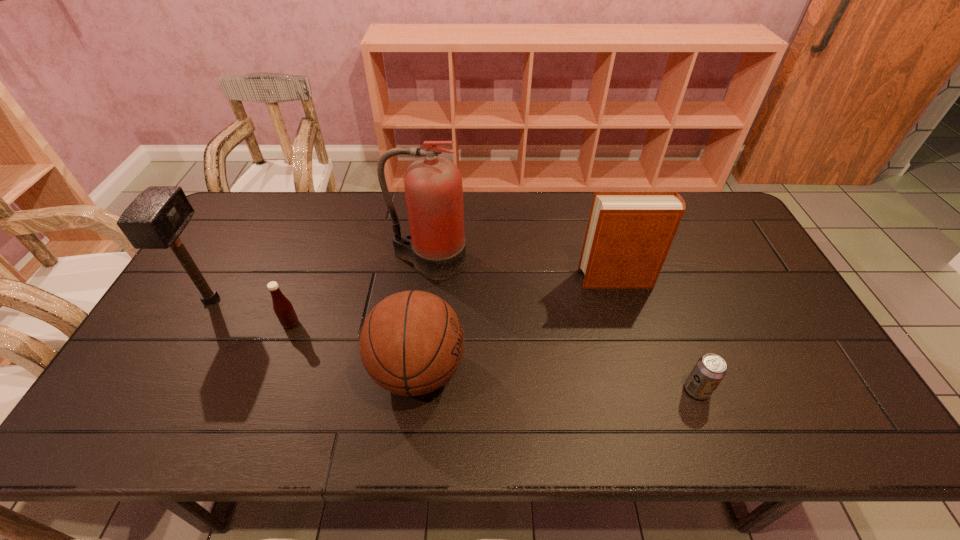
Find the location of a particular element. This screenshot has width=960, height=540. vacant space situated 0.250m on the open cover of the third tallest object is located at coordinates (496, 279).

You are a GUI agent. You are given a task and a screenshot of the screen. Output one action in this format:
    pyautogui.click(x=<x>, y=<y>)
    Task: Click on the vacant area situated on the open cover of the third tallest object
    This screenshot has width=960, height=540.
    Given the screenshot: What is the action you would take?
    pyautogui.click(x=556, y=279)

Where is `free space located on the open cover of the third tallest object`? free space located on the open cover of the third tallest object is located at coordinates pos(546,279).

Locate an element on the screen. This screenshot has height=540, width=960. free spot located on the side with brand label of the basketball is located at coordinates (493, 370).

What are the coordinates of `vacant area situated on the right of the fifth object from right to left` in the screenshot? It's located at (391, 324).

Where is `vacant space located on the back of the shortest object`? The width and height of the screenshot is (960, 540). vacant space located on the back of the shortest object is located at coordinates (672, 323).

Identify the location of object that is positioned at the near edge. The height and width of the screenshot is (540, 960). (412, 342).

In order to click on object at the left edge in this screenshot , I will do pos(155,219).

The image size is (960, 540). What are the coordinates of `vacant point at the far edge` in the screenshot? It's located at (350, 213).

In the image, there is a desktop. Identify the location of blank space at the near edge. (630, 416).